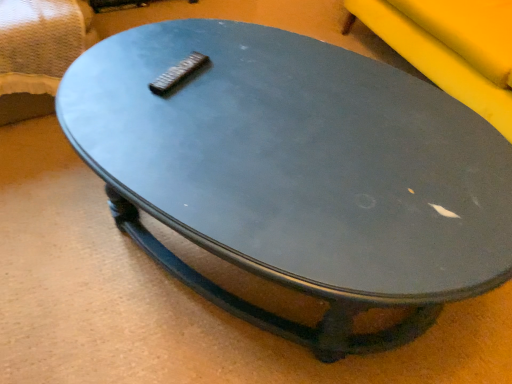
This screenshot has height=384, width=512. I want to click on vacant space positioned to the left of black plastic remote at center, so pyautogui.click(x=123, y=71).